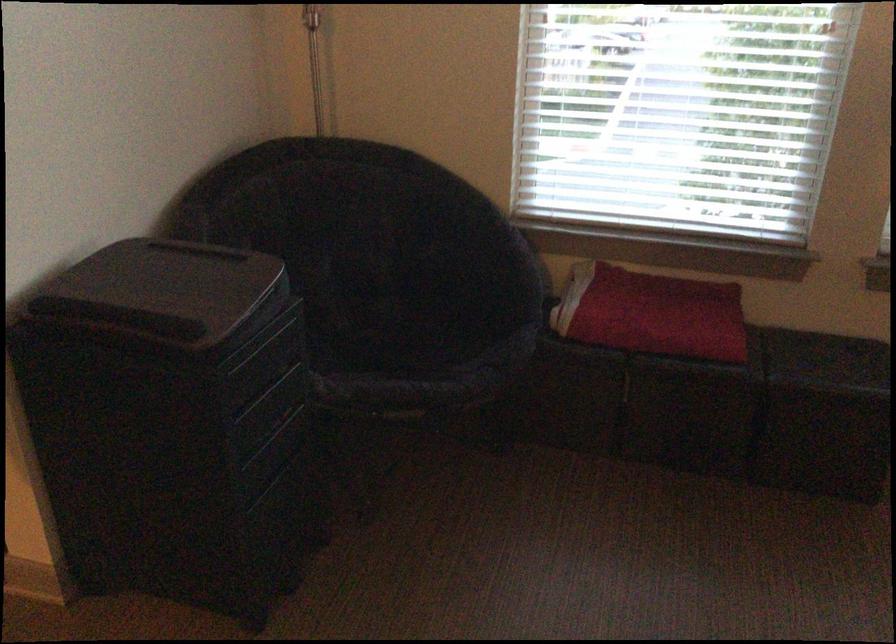
What do you see at coordinates (188, 281) in the screenshot? This screenshot has width=896, height=644. I see `the storage box lid` at bounding box center [188, 281].